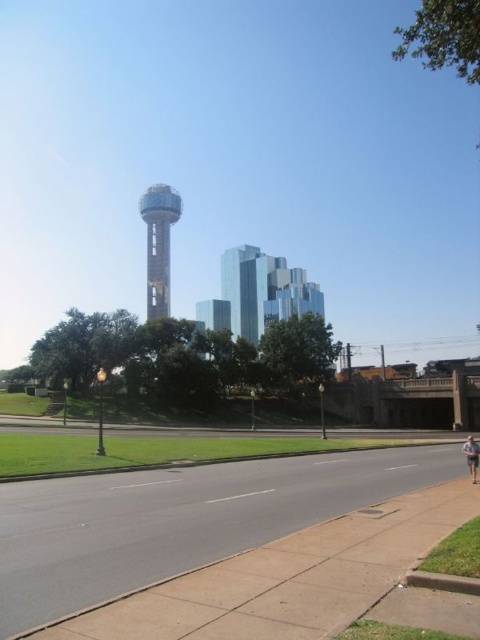
Between metallic silver water tower at center and light brown shorts at lower right, which one has less height?

light brown shorts at lower right

Can you confirm if metallic silver water tower at center is bigger than light brown shorts at lower right?

Yes, metallic silver water tower at center is bigger than light brown shorts at lower right.

Is point (159, 272) farther from camera compared to point (469, 460)?

Yes, it is.

Locate an element on the screen. Image resolution: width=480 pixels, height=640 pixels. metallic silver water tower at center is located at coordinates (158, 244).

Between point (218, 548) and point (160, 237), which one is positioned in front?

Point (218, 548) is more forward.

What do you see at coordinates (300, 563) in the screenshot? The height and width of the screenshot is (640, 480). I see `gray concrete sidewalk at lower center` at bounding box center [300, 563].

Identify the location of gray concrete sidewalk at lower center. (300, 563).

Where is `gray concrete sidewalk at lower center`? This screenshot has width=480, height=640. gray concrete sidewalk at lower center is located at coordinates (300, 563).

You are a GUI agent. You are given a task and a screenshot of the screen. Output one action in this format:
    pyautogui.click(x=<x>, y=<y>)
    Task: Click on the gray concrete sidewalk at lower center
    The height and width of the screenshot is (640, 480).
    Given the screenshot: What is the action you would take?
    pyautogui.click(x=300, y=563)

Identify the location of gray concrete sidewalk at lower center. The image size is (480, 640). (300, 563).